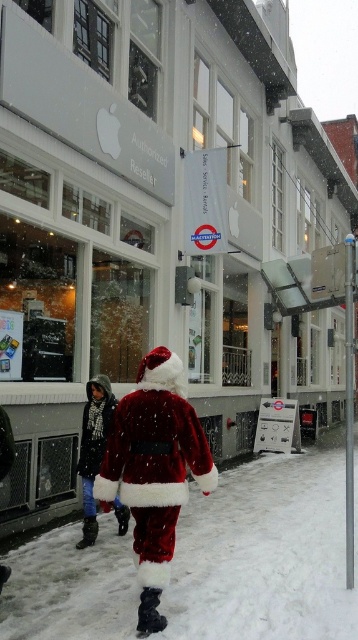
You are standing in the snowy street scene and want to know which of the two points, point (310, 586) or point (100, 397), is closer to you. Can you determine this based on the scene?

Point (310, 586) is closer to the viewer than point (100, 397).

In the scene shown: You are a photographer trying to capture the Santa Claus figure in the snowy scene. You notice two objects labeled as velvet red santa claus at center and velvet santa suit at center. Which one is positioned higher in the image?

The velvet red santa claus at center is positioned higher than the velvet santa suit at center in the image.